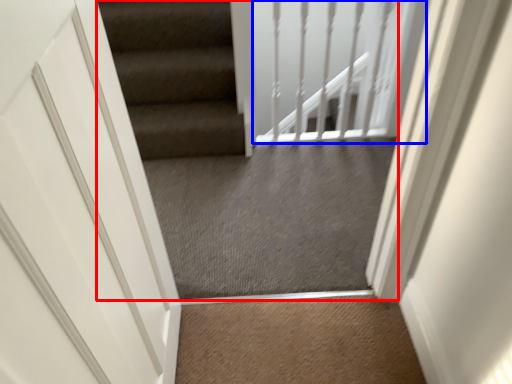
Question: Which object is closer to the camera taking this photo, escalator (highlighted by a red box) or balustrade (highlighted by a blue box)?

Choices:
 (A) escalator
 (B) balustrade

Answer: (A)